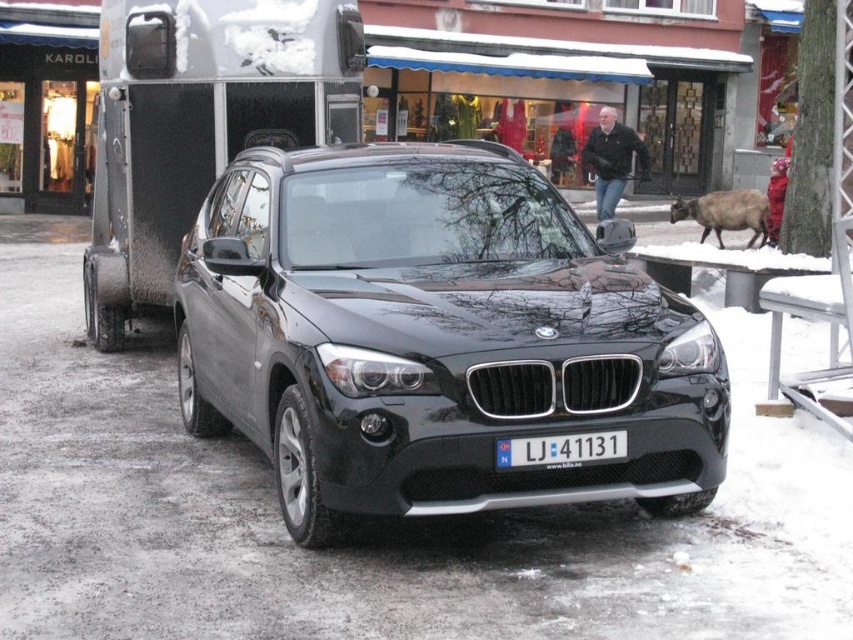
You are a photographer taking a picture of the glossy black suv at center and the white plastic license plate at center. Which object will appear larger in your photo?

The glossy black suv at center will appear larger in the photo because it is closer to the viewer than the white plastic license plate at center.

You are a delivery driver who needs to attach a GPS tracker to either the white plastic license plate at center or the brown furry goat at right. Which object is wider so that the tracker can be securely attached?

The white plastic license plate at center is wider than the brown furry goat at right, so the GPS tracker can be securely attached to the white plastic license plate at center.

You are a delivery person trying to park your 2.5 meter wide delivery van between the glossy black suv at center and the snow covered horse trailer. Can you fit your van between them?

The distance between the glossy black suv at center and the snow covered horse trailer is 4.13 meters. Since your van is 2.5 meters wide, there is enough space to park between them as 4.13 meters is greater than 2.5 meters.